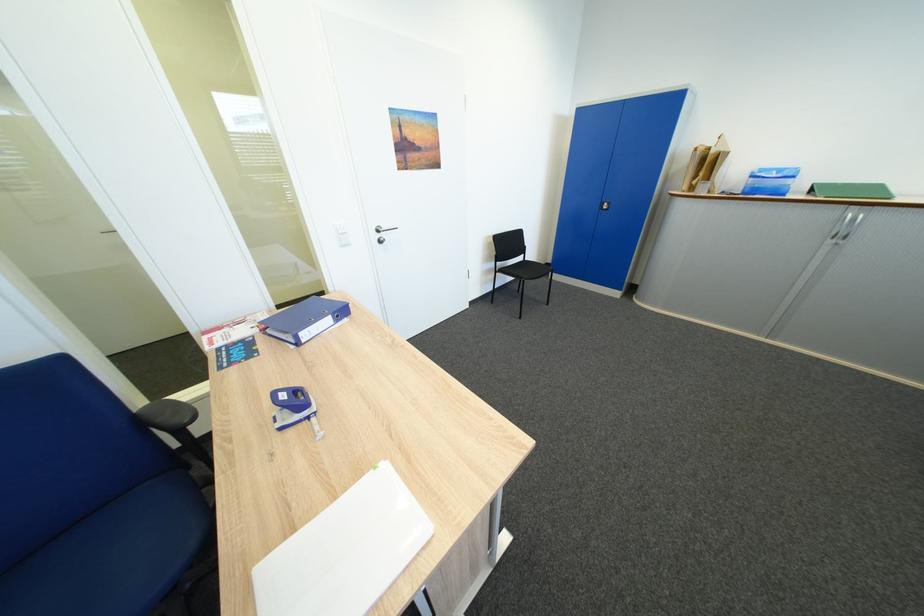
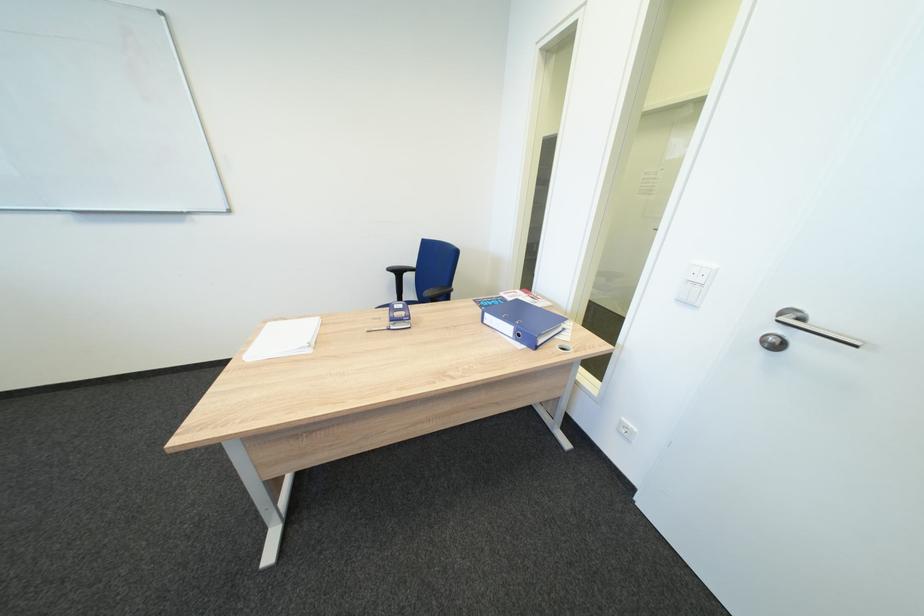
Find the pixel in the second image that matches (392,243) in the first image.

(784, 346)